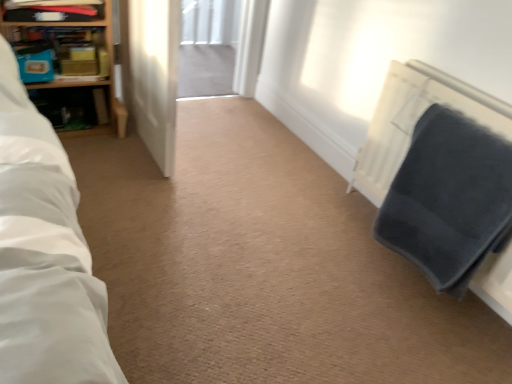
Question: Is wooden shelf at upper left, which appears as the 1th shelf when viewed from the top, positioned in front of dark grey textured blanket at right?

Choices:
 (A) yes
 (B) no

Answer: (B)

Question: Is wooden shelf at upper left, which appears as the 1th shelf when viewed from the top, far from dark grey textured blanket at right?

Choices:
 (A) no
 (B) yes

Answer: (B)

Question: Is wooden shelf at upper left, which appears as the 1th shelf when viewed from the top, aimed at dark grey textured blanket at right?

Choices:
 (A) no
 (B) yes

Answer: (A)

Question: From a real-world perspective, is wooden shelf at upper left, which is the 2th shelf in bottom-to-top order, positioned over dark grey textured blanket at right based on gravity?

Choices:
 (A) no
 (B) yes

Answer: (B)

Question: Considering the relative sizes of wooden shelf at upper left, which is the 2th shelf in bottom-to-top order, and dark grey textured blanket at right in the image provided, is wooden shelf at upper left, which is the 2th shelf in bottom-to-top order, taller than dark grey textured blanket at right?

Choices:
 (A) yes
 (B) no

Answer: (B)

Question: In terms of width, does wooden bookshelf at upper left, which is counted as the 1th shelf, starting from the bottom, look wider or thinner when compared to transparent glass screen door at center?

Choices:
 (A) thin
 (B) wide

Answer: (A)

Question: In terms of height, does wooden bookshelf at upper left, which is counted as the 1th shelf, starting from the bottom, look taller or shorter compared to transparent glass screen door at center?

Choices:
 (A) tall
 (B) short

Answer: (B)

Question: Is wooden bookshelf at upper left, which is counted as the 1th shelf, starting from the bottom, inside or outside of transparent glass screen door at center?

Choices:
 (A) inside
 (B) outside

Answer: (B)

Question: Relative to transparent glass screen door at center, is wooden bookshelf at upper left, acting as the second shelf starting from the top, in front or behind?

Choices:
 (A) front
 (B) behind

Answer: (B)

Question: In terms of size, does wooden shelf at upper left, which is the 2th shelf in bottom-to-top order, appear bigger or smaller than transparent glass screen door at center?

Choices:
 (A) big
 (B) small

Answer: (B)

Question: From the image's perspective, is wooden shelf at upper left, which is the 2th shelf in bottom-to-top order, positioned above or below transparent glass screen door at center?

Choices:
 (A) below
 (B) above

Answer: (B)

Question: Is point [x=51, y=11] closer or farther from the camera than point [x=167, y=21]?

Choices:
 (A) closer
 (B) farther

Answer: (B)

Question: In terms of height, does wooden shelf at upper left, which is the 2th shelf in bottom-to-top order, look taller or shorter compared to transparent glass screen door at center?

Choices:
 (A) tall
 (B) short

Answer: (B)

Question: Would you say transparent glass screen door at center is inside or outside wooden bookshelf at upper left, acting as the second shelf starting from the top?

Choices:
 (A) inside
 (B) outside

Answer: (B)

Question: From the image's perspective, is transparent glass screen door at center above or below wooden bookshelf at upper left, acting as the second shelf starting from the top?

Choices:
 (A) above
 (B) below

Answer: (B)